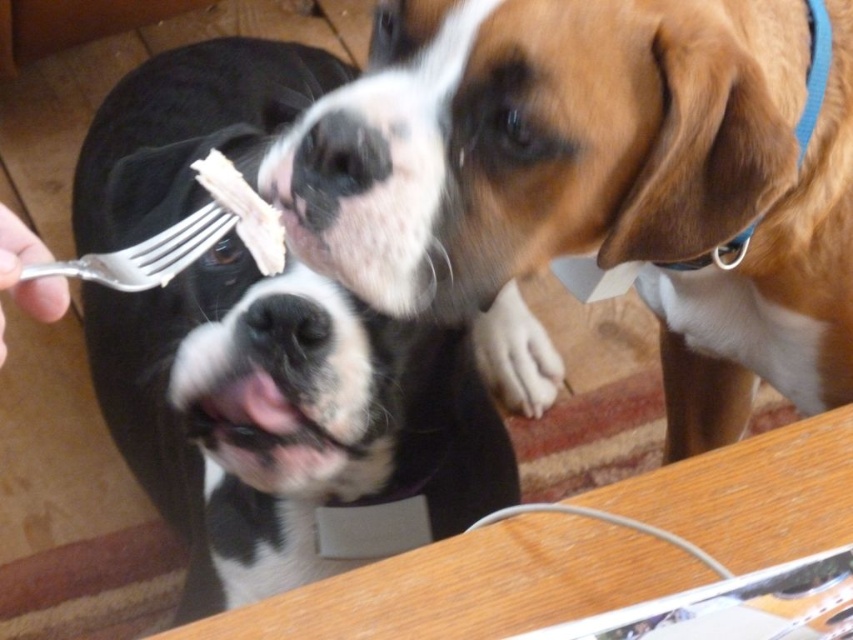
Question: Estimate the real-world distances between objects in this image. Which object is closer to the brown furry dog at upper right?

Choices:
 (A) white fur at lower center
 (B) silver metallic fork at lower left
 (C) black glossy fur at left

Answer: (B)

Question: Is brown furry dog at upper right positioned before silver metallic fork at lower left?

Choices:
 (A) yes
 (B) no

Answer: (B)

Question: Which point is closer to the camera?

Choices:
 (A) (845, 10)
 (B) (126, 289)
 (C) (305, 426)
 (D) (511, 296)

Answer: (B)

Question: Can you confirm if white fur at lower center is positioned to the right of silver metallic fork at lower left?

Choices:
 (A) no
 (B) yes

Answer: (B)

Question: Is black glossy fur at left below white fur at lower center?

Choices:
 (A) yes
 (B) no

Answer: (B)

Question: Which of these objects is positioned closest to the white fur at lower center?

Choices:
 (A) silver metallic fork at lower left
 (B) brown furry dog at upper right
 (C) black glossy fur at left

Answer: (C)